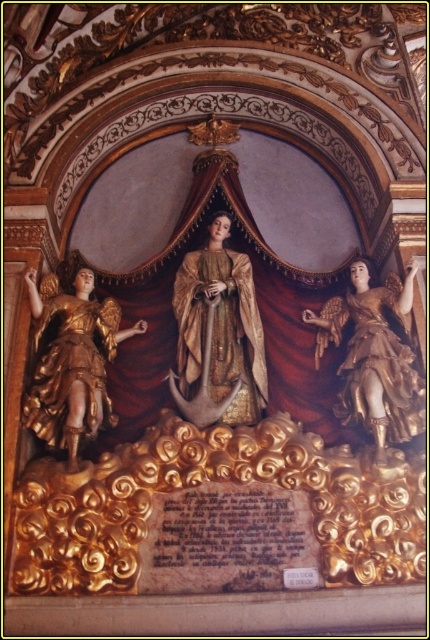
How far apart are the two gold textured fabric at center?

The gold textured fabric at center are 52.70 meters apart.

You are an art conservator examining the religious sculpture. You notice a specific point at coordinates [218,336]. What material is located at this point?

The point at coordinates [218,336] corresponds to gold textured fabric at center.